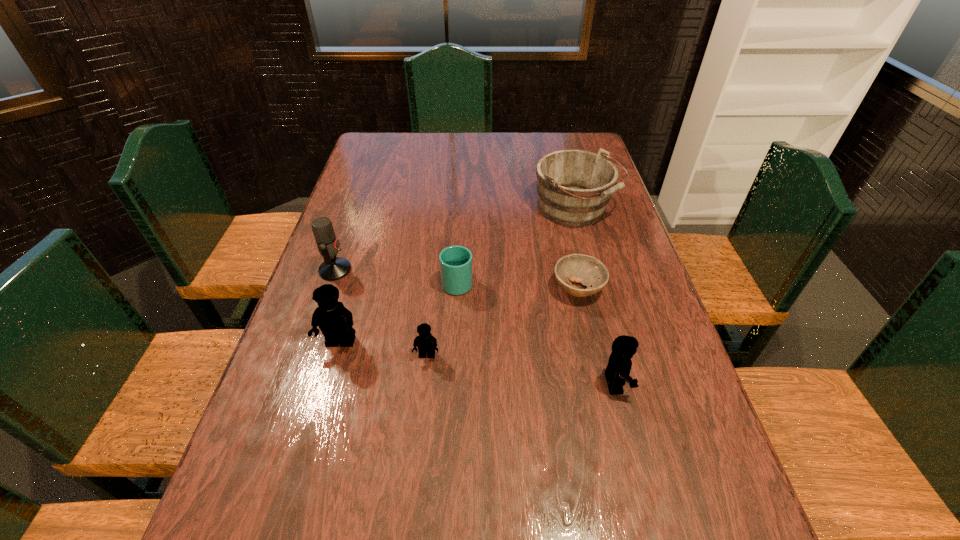
This screenshot has height=540, width=960. What are the coordinates of `blank space that satisfies the following two spatial constraints: 1. on the front side of the wine bucket; 2. on the side of the microphone with the red ring` in the screenshot? It's located at (591, 270).